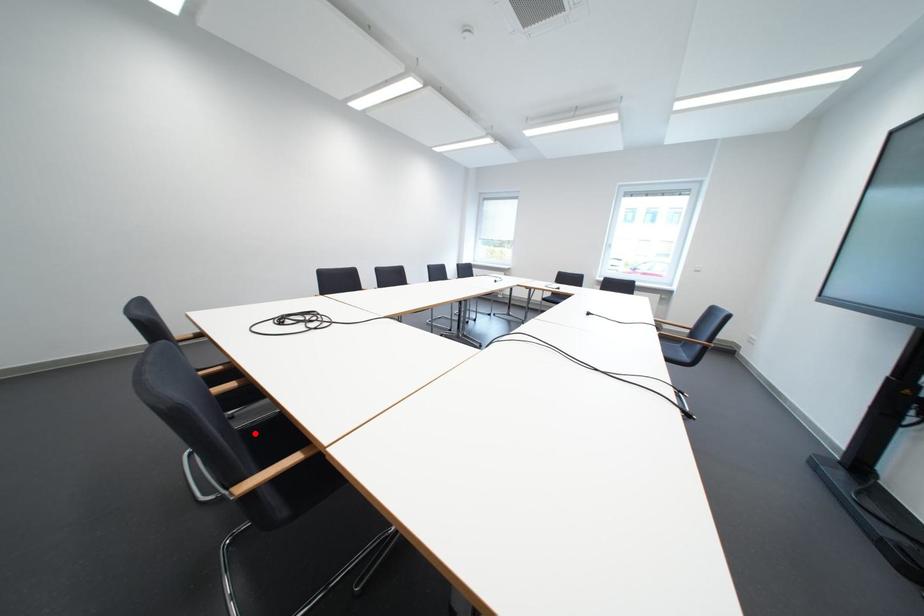
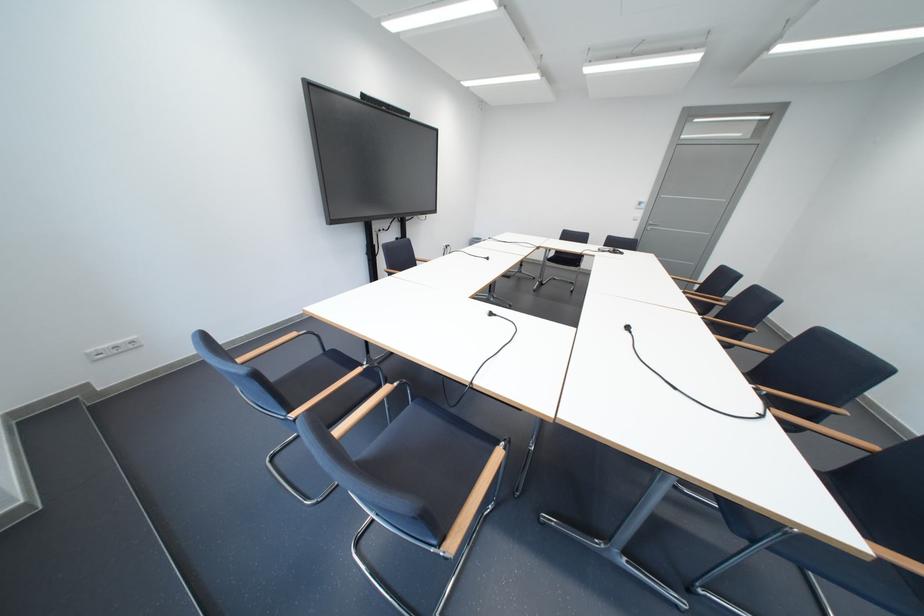
Question: I am providing you with two images of the same scene from different viewpoints. A red point is marked on the first image. At the location where the point appears in image 1, is it still visible in image 2?

Choices:
 (A) Yes
 (B) No

Answer: (B)